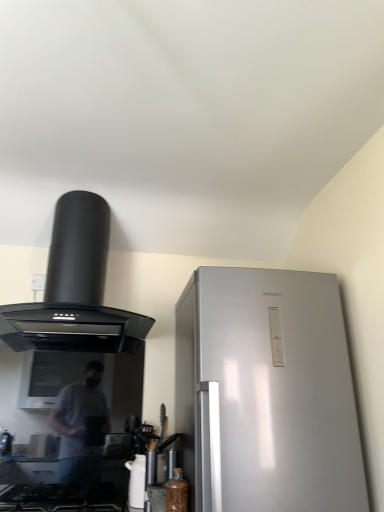
Question: Considering the relative sizes of black glass gas stove at lower left and white glossy kettle at lower center in the image provided, is black glass gas stove at lower left thinner than white glossy kettle at lower center?

Choices:
 (A) no
 (B) yes

Answer: (A)

Question: Is black glass gas stove at lower left bigger than white glossy kettle at lower center?

Choices:
 (A) no
 (B) yes

Answer: (B)

Question: Is black glass gas stove at lower left in contact with white glossy kettle at lower center?

Choices:
 (A) no
 (B) yes

Answer: (A)

Question: From a real-world perspective, is black glass gas stove at lower left beneath white glossy kettle at lower center?

Choices:
 (A) yes
 (B) no

Answer: (A)

Question: Would you say white glossy kettle at lower center is part of black glass gas stove at lower left's contents?

Choices:
 (A) yes
 (B) no

Answer: (B)

Question: From a real-world perspective, is black matte range hood at upper left above or below white glossy kettle at lower center?

Choices:
 (A) above
 (B) below

Answer: (A)

Question: Would you say black matte range hood at upper left is to the left or to the right of white glossy kettle at lower center in the picture?

Choices:
 (A) right
 (B) left

Answer: (B)

Question: Is point (105, 253) positioned closer to the camera than point (135, 499)?

Choices:
 (A) farther
 (B) closer

Answer: (A)

Question: Is black matte range hood at upper left bigger or smaller than white glossy kettle at lower center?

Choices:
 (A) small
 (B) big

Answer: (B)

Question: Is black matte range hood at upper left to the left or to the right of black glass gas stove at lower left in the image?

Choices:
 (A) left
 (B) right

Answer: (A)

Question: In terms of size, does black matte range hood at upper left appear bigger or smaller than black glass gas stove at lower left?

Choices:
 (A) big
 (B) small

Answer: (A)

Question: Does point (86, 271) appear closer or farther from the camera than point (44, 502)?

Choices:
 (A) closer
 (B) farther

Answer: (B)

Question: From a real-world perspective, is black matte range hood at upper left above or below black glass gas stove at lower left?

Choices:
 (A) above
 (B) below

Answer: (A)

Question: In the image, is black matte range hood at upper left on the left side or the right side of translucent glass bottle at lower center?

Choices:
 (A) right
 (B) left

Answer: (B)

Question: From their relative heights in the image, would you say black matte range hood at upper left is taller or shorter than translucent glass bottle at lower center?

Choices:
 (A) tall
 (B) short

Answer: (A)